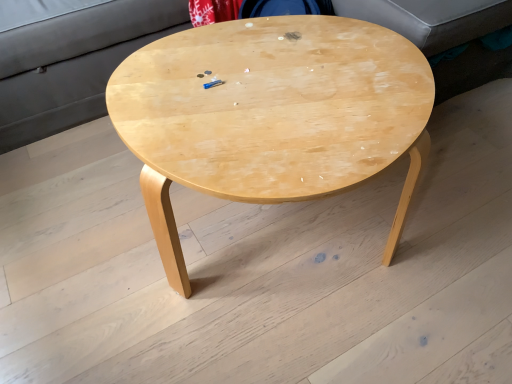
Locate an element on the screen. vacant region to the right of natural wood coffee table at center is located at coordinates (463, 211).